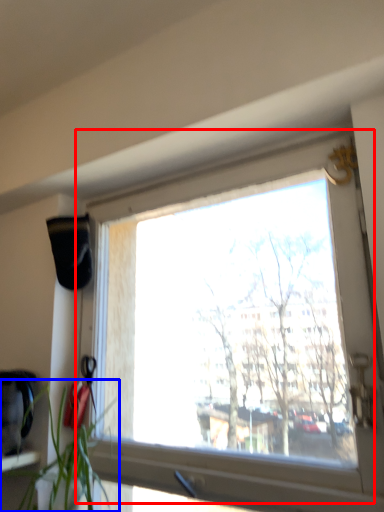
Question: Which of the following is the farthest to the observer, window (highlighted by a red box) or houseplant (highlighted by a blue box)?

Choices:
 (A) window
 (B) houseplant

Answer: (A)